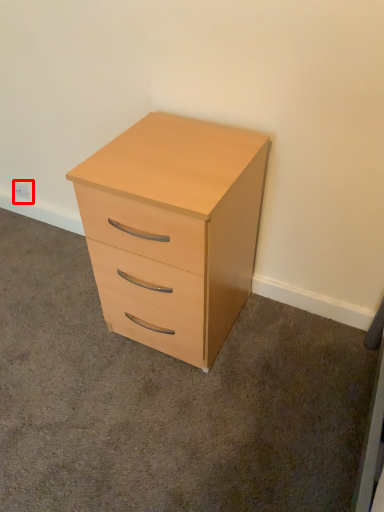
Question: In this image, where is electric outlet (annotated by the red box) located relative to chest of drawers?

Choices:
 (A) right
 (B) left

Answer: (B)